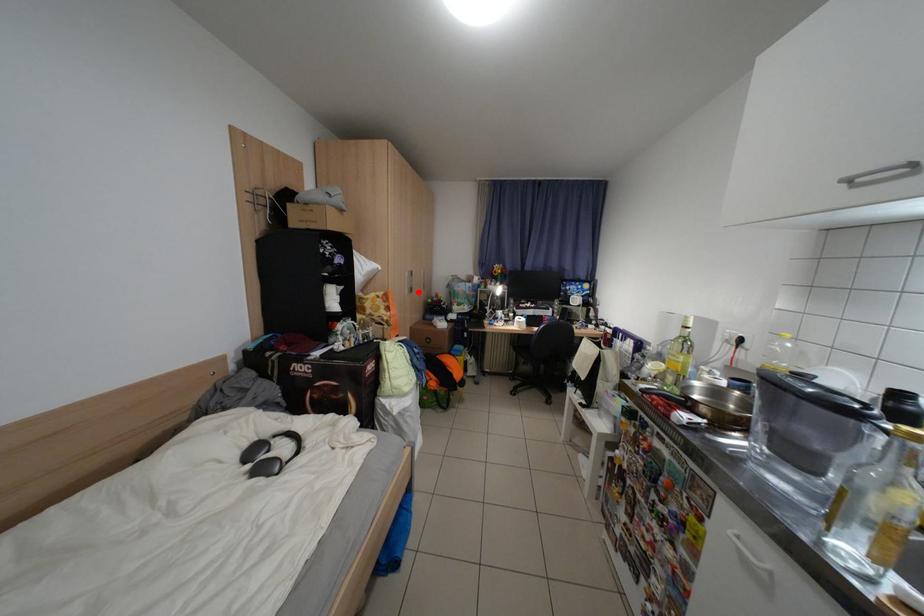
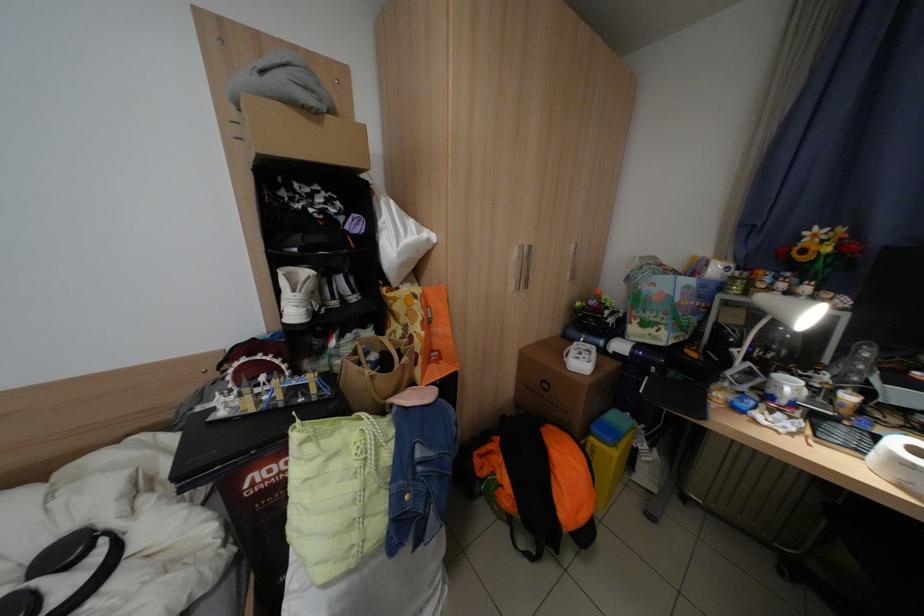
Find the pixel in the second image that matches the highlighted location in the first image.

(524, 286)